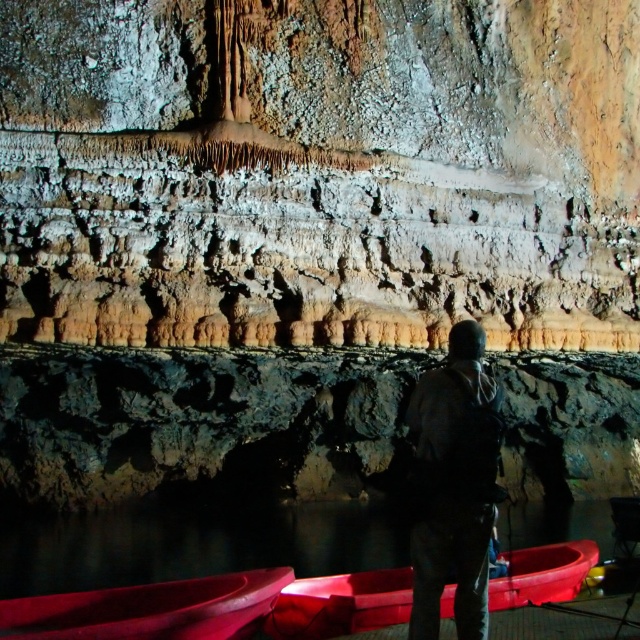
Is dark gray fabric jacket at center to the right of rubber boat at lower left from the viewer's perspective?

Indeed, dark gray fabric jacket at center is positioned on the right side of rubber boat at lower left.

Can you confirm if dark gray fabric jacket at center is bigger than rubber boat at lower left?

No, dark gray fabric jacket at center is not bigger than rubber boat at lower left.

Image resolution: width=640 pixels, height=640 pixels. I want to click on dark gray fabric jacket at center, so click(454, 484).

This screenshot has width=640, height=640. I want to click on dark gray fabric jacket at center, so click(454, 484).

How distant is rubber boat at lower left from rubber boat at lower center?

rubber boat at lower left is 24.94 feet from rubber boat at lower center.

In the scene shown: Can you confirm if rubber boat at lower left is positioned to the left of rubber boat at lower center?

Indeed, rubber boat at lower left is positioned on the left side of rubber boat at lower center.

Identify the location of rubber boat at lower left. (148, 609).

At what (x,y) coordinates should I click in order to perform the action: click on rubber boat at lower left. Please return your answer as a coordinate pair (x, y). Looking at the image, I should click on (148, 609).

Is dark gray fabric jacket at center wider than rubber boat at lower center?

In fact, dark gray fabric jacket at center might be narrower than rubber boat at lower center.

Does dark gray fabric jacket at center have a larger size compared to rubber boat at lower center?

Actually, dark gray fabric jacket at center might be smaller than rubber boat at lower center.

Who is more distant from viewer, (x=413, y=592) or (x=352, y=625)?

The point (x=352, y=625) is behind.

Find the location of a particular element. The image size is (640, 640). dark gray fabric jacket at center is located at coordinates (454, 484).